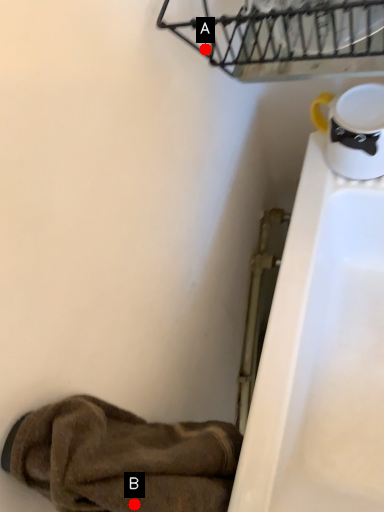
Question: Two points are circled on the image, labeled by A and B beside each circle. Which point appears farthest from the camera in this image?

Choices:
 (A) A is further
 (B) B is further

Answer: (A)